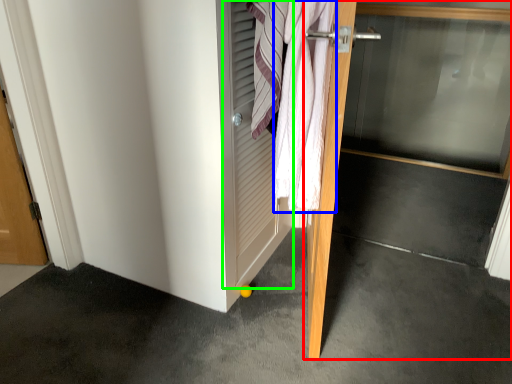
Question: Which object is the closest to the door (highlighted by a red box)? Choose among these: bath towel (highlighted by a blue box) or screen door (highlighted by a green box).

Choices:
 (A) bath towel
 (B) screen door

Answer: (A)